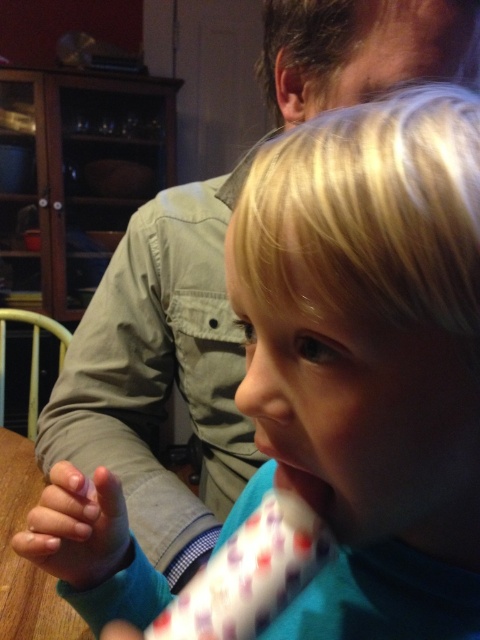
Who is positioned more to the left, smooth skin hand at lower left or matte pink lips at center?

Positioned to the left is smooth skin hand at lower left.

Based on the photo, which of these two, smooth skin hand at lower left or matte pink lips at center, stands taller?

smooth skin hand at lower left

Which is in front, point (48, 564) or point (292, 465)?

Point (292, 465) is in front.

At what (x,y) coordinates should I click in order to perform the action: click on smooth skin hand at lower left. Please return your answer as a coordinate pair (x, y). The height and width of the screenshot is (640, 480). Looking at the image, I should click on (78, 528).

Which is below, smooth skin hand at lower left or wooden table at lower left?

wooden table at lower left is below.

You are a GUI agent. You are given a task and a screenshot of the screen. Output one action in this format:
    pyautogui.click(x=<x>, y=<y>)
    Task: Click on the smooth skin hand at lower left
    The image size is (480, 640).
    Given the screenshot: What is the action you would take?
    pyautogui.click(x=78, y=528)

Does wooden table at lower left appear on the right side of matte pink lips at center?

In fact, wooden table at lower left is to the left of matte pink lips at center.

Does wooden table at lower left appear under matte pink lips at center?

Indeed, wooden table at lower left is positioned under matte pink lips at center.

Does point (43, 618) lie in front of point (288, 468)?

No, (43, 618) is further to viewer.

At what (x,y) coordinates should I click in order to perform the action: click on wooden table at lower left. Please return your answer as a coordinate pair (x, y). Looking at the image, I should click on (24, 557).